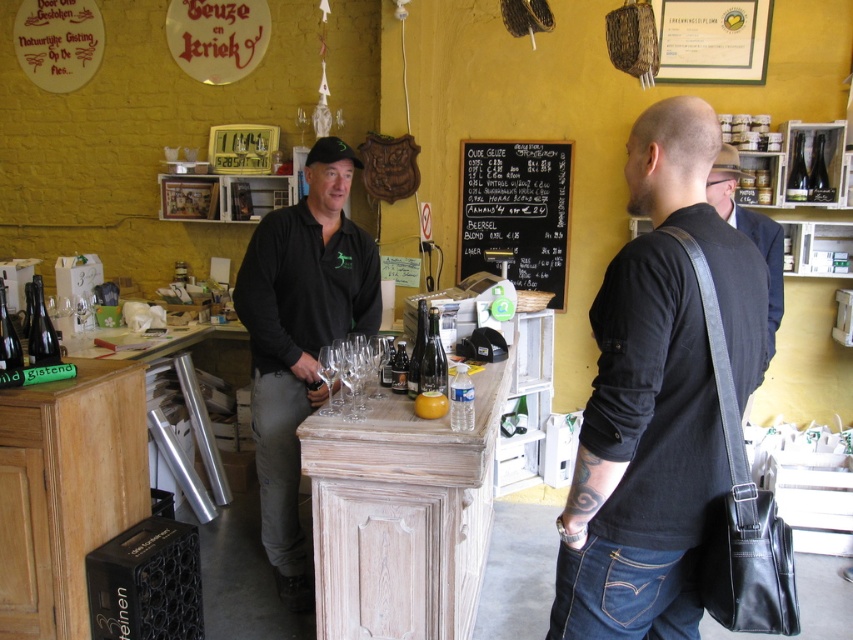
You are a customer standing at the entrance of the bar. You see two points marked on the counter. The first point is at position point (48,323) and the second is at point (795,168). Which point is closer to you?

Point (48,323) is in front of point (795,168), so the first point is closer to you.